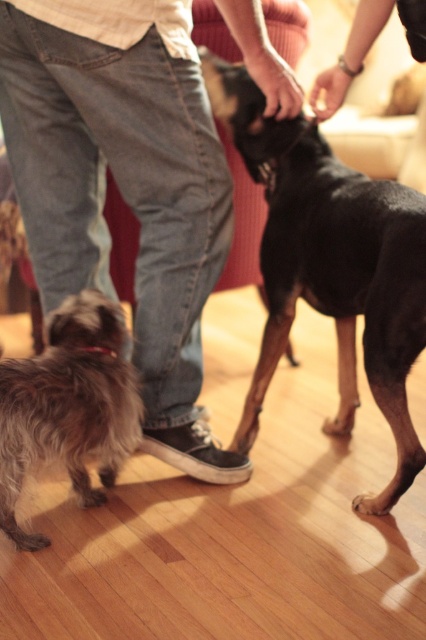
Can you confirm if jeans at center is wider than black smooth dog at center?

Indeed, jeans at center has a greater width compared to black smooth dog at center.

Does jeans at center lie in front of black smooth dog at center?

Yes, jeans at center is closer to the viewer.

Image resolution: width=426 pixels, height=640 pixels. What are the coordinates of `jeans at center` in the screenshot? It's located at (123, 186).

You are a GUI agent. You are given a task and a screenshot of the screen. Output one action in this format:
    pyautogui.click(x=<x>, y=<y>)
    Task: Click on the jeans at center
    
    Given the screenshot: What is the action you would take?
    pyautogui.click(x=123, y=186)

Which is behind, point (339, 321) or point (57, 336)?

Positioned behind is point (339, 321).

Is black smooth dog at center to the right of fuzzy brown dog at lower left from the viewer's perspective?

Yes, black smooth dog at center is to the right of fuzzy brown dog at lower left.

Describe the element at coordinates (331, 264) in the screenshot. The height and width of the screenshot is (640, 426). I see `black smooth dog at center` at that location.

Image resolution: width=426 pixels, height=640 pixels. What are the coordinates of `black smooth dog at center` in the screenshot? It's located at (331, 264).

Who is higher up, jeans at center or fuzzy brown dog at lower left?

Positioned higher is jeans at center.

How much distance is there between jeans at center and fuzzy brown dog at lower left?

The distance of jeans at center from fuzzy brown dog at lower left is 32.80 centimeters.

Between point (86, 154) and point (77, 486), which one is positioned in front?

Point (77, 486)

At what (x,y) coordinates should I click in order to perform the action: click on jeans at center. Please return your answer as a coordinate pair (x, y). Looking at the image, I should click on (123, 186).